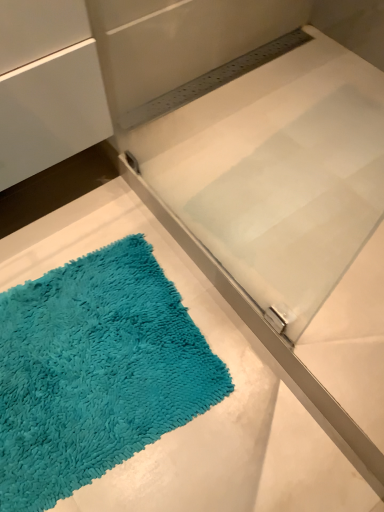
Identify the location of free point above turquoise shaggy bath mat at lower left (from a real-world perspective). (90, 350).